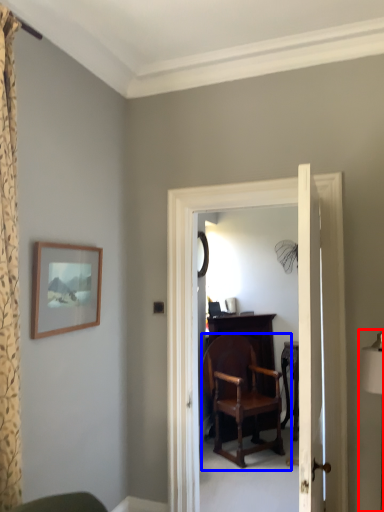
Question: Which of the following is the farthest to the observer, table lamp (highlighted by a red box) or chair (highlighted by a blue box)?

Choices:
 (A) table lamp
 (B) chair

Answer: (B)